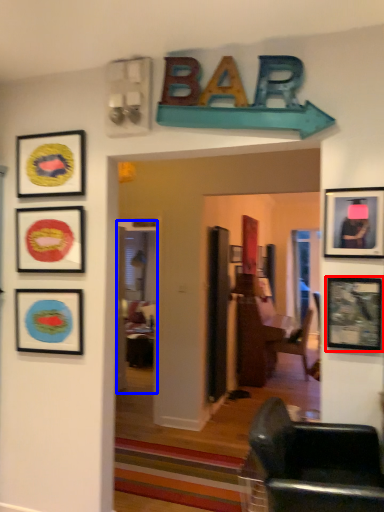
Question: Among these objects, which one is farthest to the camera, picture frame (highlighted by a red box) or glass door (highlighted by a blue box)?

Choices:
 (A) picture frame
 (B) glass door

Answer: (B)